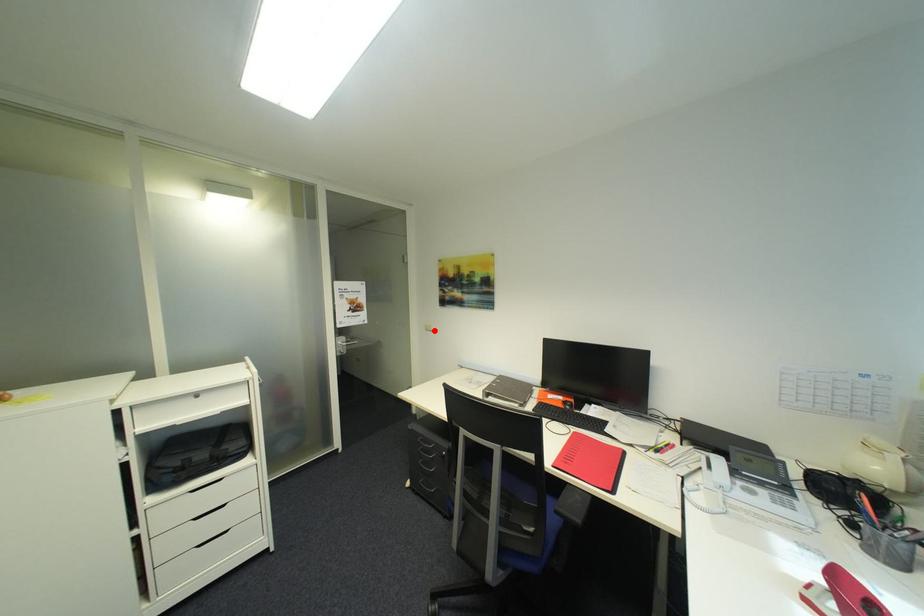
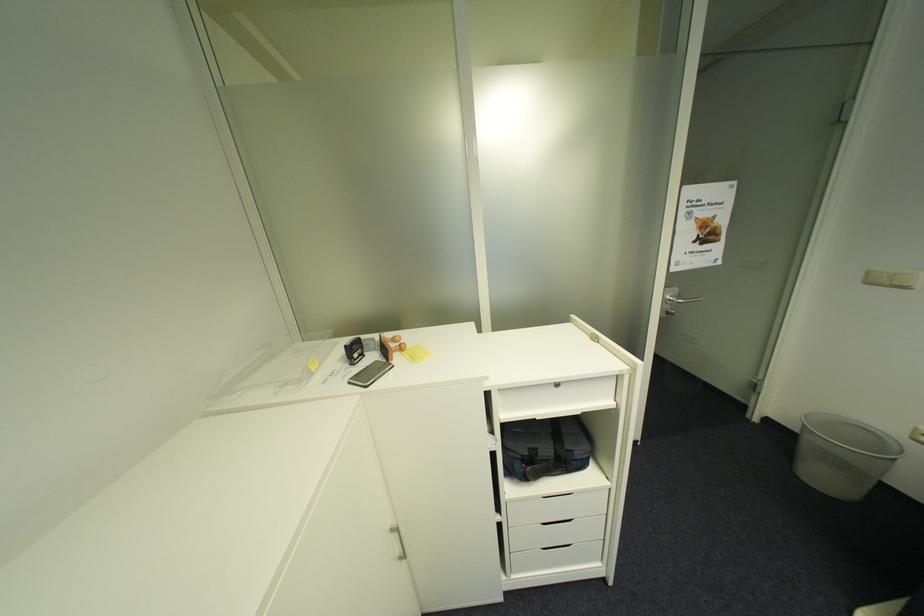
Question: I am providing you with two images of the same scene from different viewpoints. A red point is marked on the first image. Can you still see the location of the red point in image 2?

Choices:
 (A) Yes
 (B) No

Answer: (A)